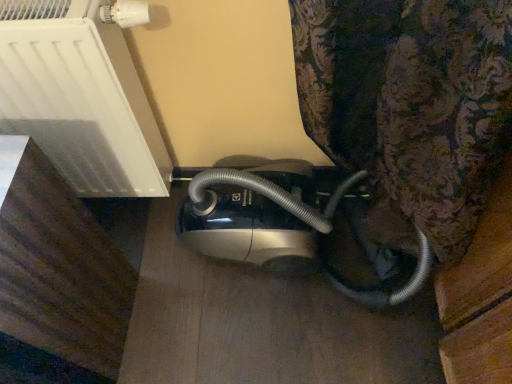
Question: Which direction should I rotate to look at satin silver vacuum cleaner at lower center?

Choices:
 (A) left
 (B) right

Answer: (A)

Question: Is metallic silver vacuum cleaner at center closer to the viewer compared to satin silver vacuum cleaner at lower center?

Choices:
 (A) yes
 (B) no

Answer: (B)

Question: From a real-world perspective, is metallic silver vacuum cleaner at center located higher than satin silver vacuum cleaner at lower center?

Choices:
 (A) yes
 (B) no

Answer: (B)

Question: Is the surface of metallic silver vacuum cleaner at center in direct contact with satin silver vacuum cleaner at lower center?

Choices:
 (A) yes
 (B) no

Answer: (B)

Question: Can you confirm if metallic silver vacuum cleaner at center is positioned to the right of satin silver vacuum cleaner at lower center?

Choices:
 (A) no
 (B) yes

Answer: (B)

Question: From a real-world perspective, is metallic silver vacuum cleaner at center under satin silver vacuum cleaner at lower center?

Choices:
 (A) no
 (B) yes

Answer: (B)

Question: Does metallic silver vacuum cleaner at center turn towards satin silver vacuum cleaner at lower center?

Choices:
 (A) yes
 (B) no

Answer: (B)

Question: Is satin silver vacuum cleaner at lower center further to camera compared to metallic silver vacuum cleaner at center?

Choices:
 (A) no
 (B) yes

Answer: (A)

Question: Can you confirm if satin silver vacuum cleaner at lower center is positioned to the left of metallic silver vacuum cleaner at center?

Choices:
 (A) yes
 (B) no

Answer: (A)

Question: Can metallic silver vacuum cleaner at center be found inside satin silver vacuum cleaner at lower center?

Choices:
 (A) yes
 (B) no

Answer: (B)

Question: Is the position of satin silver vacuum cleaner at lower center less distant than that of metallic silver vacuum cleaner at center?

Choices:
 (A) yes
 (B) no

Answer: (A)

Question: From a real-world perspective, is satin silver vacuum cleaner at lower center located higher than metallic silver vacuum cleaner at center?

Choices:
 (A) yes
 (B) no

Answer: (A)

Question: Does satin silver vacuum cleaner at lower center appear on the right side of metallic silver vacuum cleaner at center?

Choices:
 (A) no
 (B) yes

Answer: (A)

Question: Looking at their shapes, would you say satin silver vacuum cleaner at lower center is wider or thinner than metallic silver vacuum cleaner at center?

Choices:
 (A) wide
 (B) thin

Answer: (B)